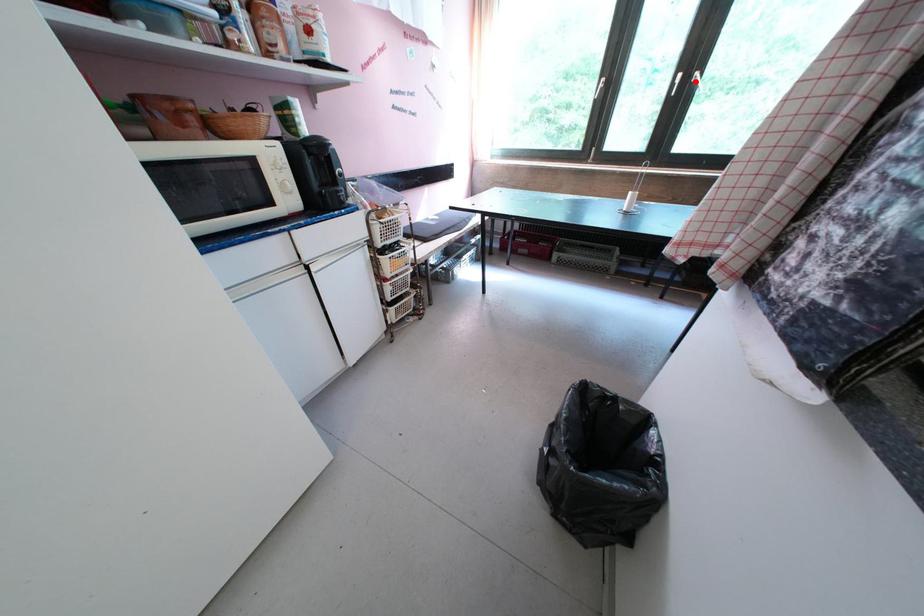
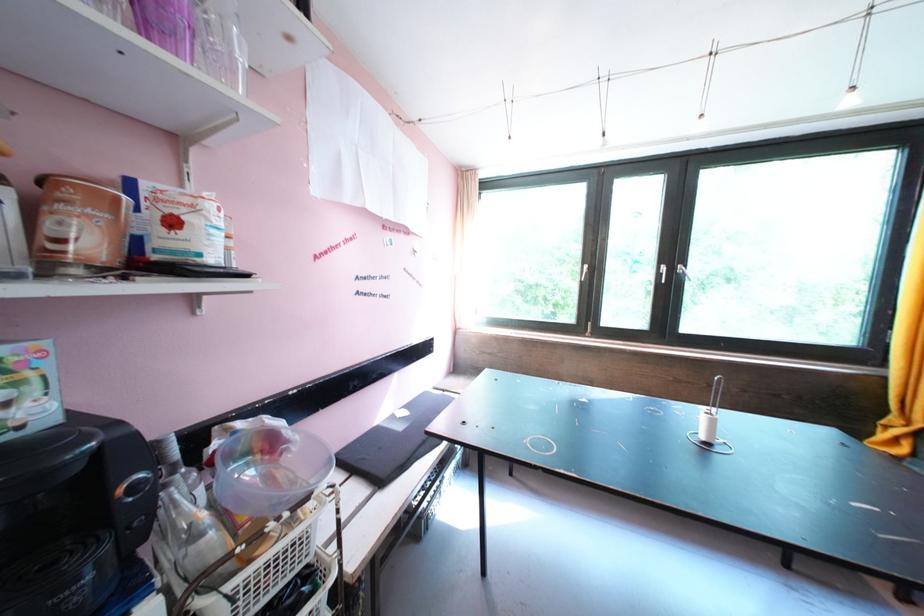
Find the pixel in the second image that matches the highlighted location in the first image.

(679, 273)